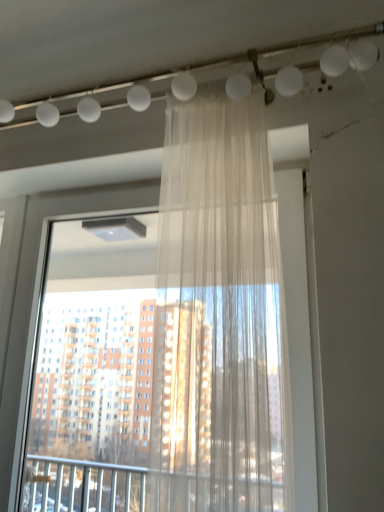
Question: Can you confirm if transparent fabric curtain at center is shorter than sheer white curtain at center?

Choices:
 (A) no
 (B) yes

Answer: (A)

Question: Considering the relative positions of transparent fabric curtain at center and sheer white curtain at center in the image provided, is transparent fabric curtain at center to the right of sheer white curtain at center from the viewer's perspective?

Choices:
 (A) no
 (B) yes

Answer: (A)

Question: Does transparent fabric curtain at center come in front of sheer white curtain at center?

Choices:
 (A) no
 (B) yes

Answer: (A)

Question: From the image's perspective, is transparent fabric curtain at center located above sheer white curtain at center?

Choices:
 (A) yes
 (B) no

Answer: (B)

Question: Does transparent fabric curtain at center have a greater width compared to sheer white curtain at center?

Choices:
 (A) yes
 (B) no

Answer: (B)

Question: Is transparent fabric curtain at center outside sheer white curtain at center?

Choices:
 (A) yes
 (B) no

Answer: (A)

Question: Does sheer white curtain at center have a larger size compared to transparent fabric curtain at center?

Choices:
 (A) no
 (B) yes

Answer: (A)

Question: Considering the relative positions of sheer white curtain at center and transparent fabric curtain at center in the image provided, is sheer white curtain at center behind transparent fabric curtain at center?

Choices:
 (A) no
 (B) yes

Answer: (A)

Question: Is sheer white curtain at center shorter than transparent fabric curtain at center?

Choices:
 (A) no
 (B) yes

Answer: (B)

Question: Does sheer white curtain at center lie in front of transparent fabric curtain at center?

Choices:
 (A) no
 (B) yes

Answer: (B)

Question: From the image's perspective, is sheer white curtain at center over transparent fabric curtain at center?

Choices:
 (A) no
 (B) yes

Answer: (B)

Question: From the image's perspective, is sheer white curtain at center beneath transparent fabric curtain at center?

Choices:
 (A) no
 (B) yes

Answer: (A)

Question: Is transparent fabric curtain at center taller or shorter than sheer white curtain at center?

Choices:
 (A) tall
 (B) short

Answer: (A)